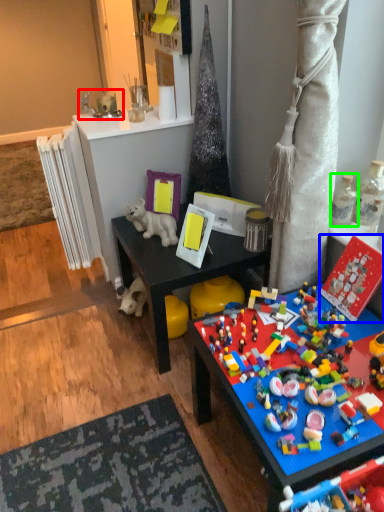
Question: Estimate the real-world distances between objects in this image. Which object is farther from toy (highlighted by a red box), toy (highlighted by a blue box) or toy (highlighted by a green box)?

Choices:
 (A) toy
 (B) toy

Answer: (A)